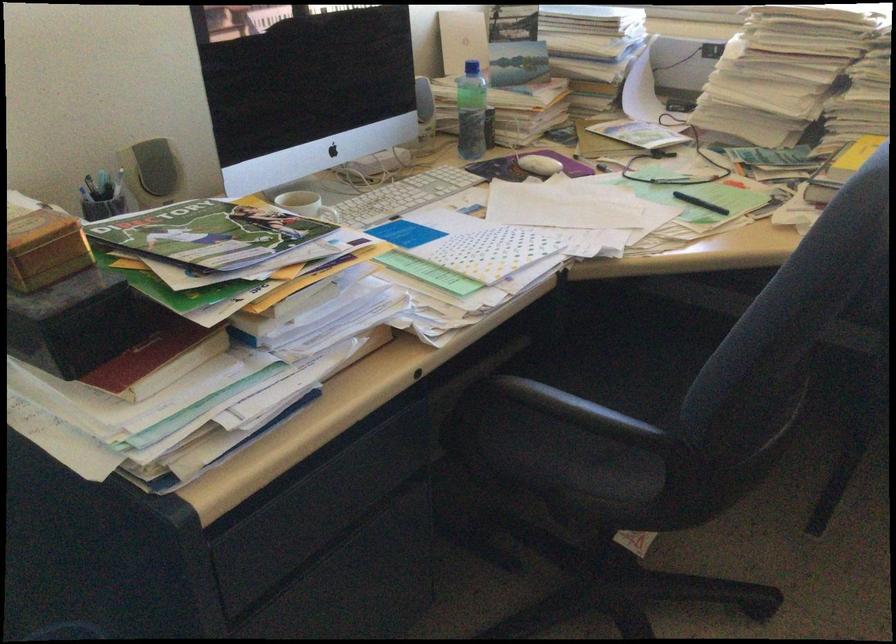
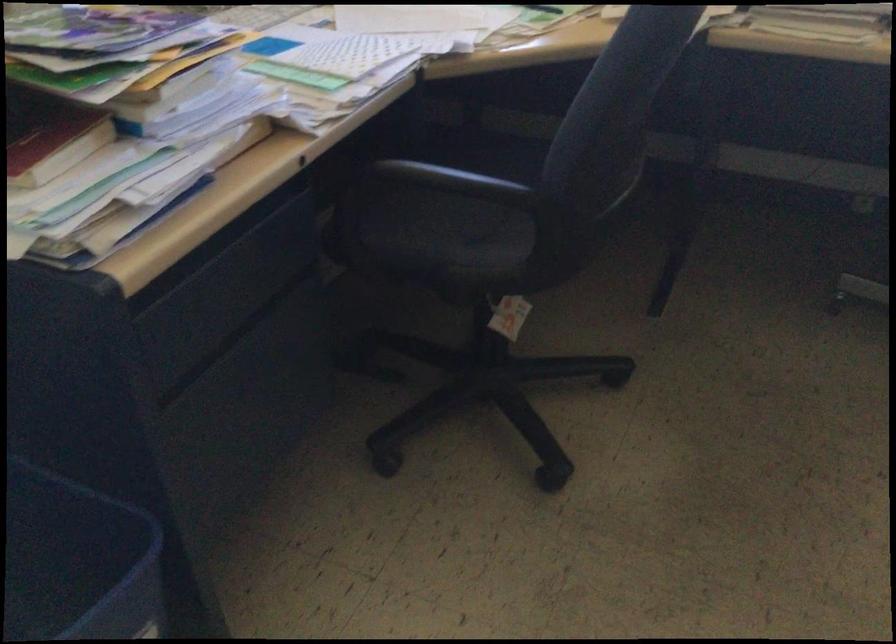
Question: The camera is either moving clockwise (left) or counter-clockwise (right) around the object. The first image is from the beginning of the video and the second image is from the end. Is the camera moving left or right when shooting the video?

Choices:
 (A) Left
 (B) Right

Answer: (A)